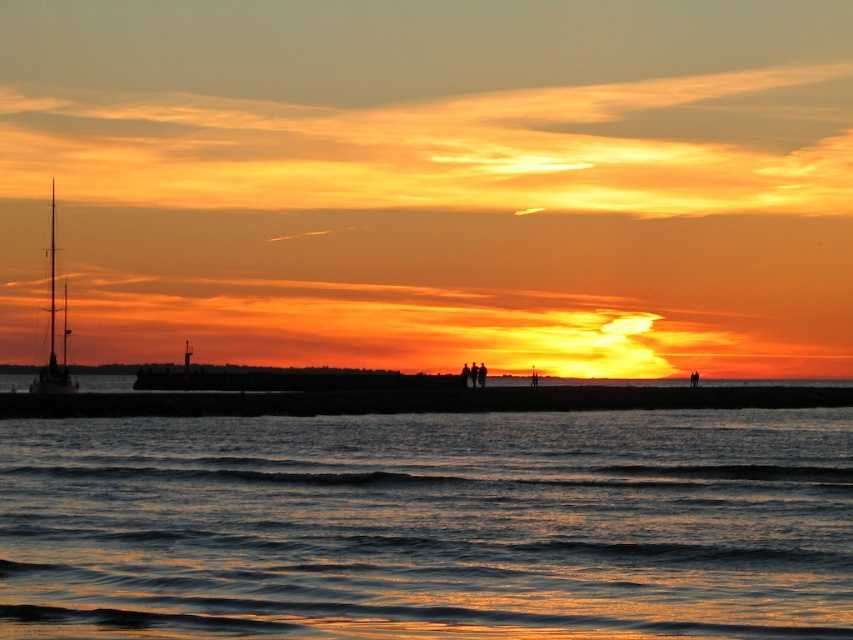
Does shiny metallic water at lower center come behind shiny metallic sailboat at left?

No, it is in front of shiny metallic sailboat at left.

Based on the photo, is shiny metallic water at lower center to the left of shiny metallic sailboat at left from the viewer's perspective?

In fact, shiny metallic water at lower center is to the right of shiny metallic sailboat at left.

The width and height of the screenshot is (853, 640). What do you see at coordinates (428, 524) in the screenshot? I see `shiny metallic water at lower center` at bounding box center [428, 524].

What are the coordinates of `shiny metallic water at lower center` in the screenshot? It's located at (428, 524).